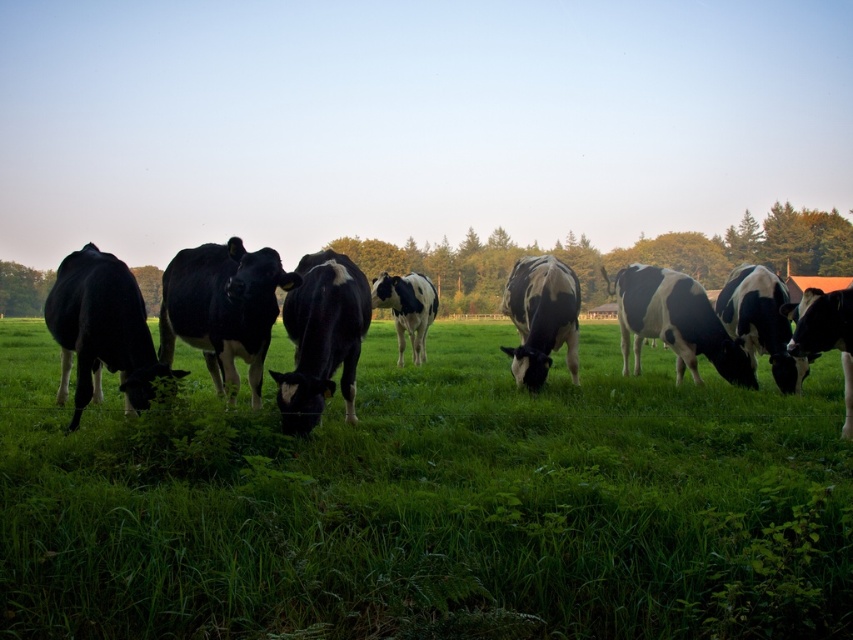
You are standing in the field and see the green grassy at center and the black and white spotted cow at center. Which one is nearer to you?

The green grassy at center is closer to the viewer than the black and white spotted cow at center, so the green grassy at center is nearer to you.

You are a farmer checking the field. You notice the green grassy at center and the black and white spotted cow at center. Which one is taller?

The black and white spotted cow at center is taller than the green grassy at center.